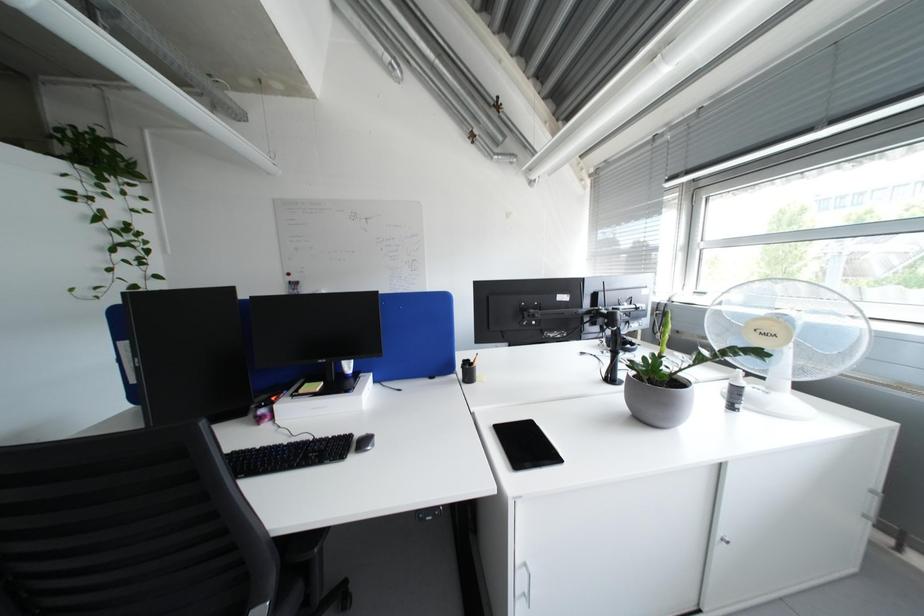
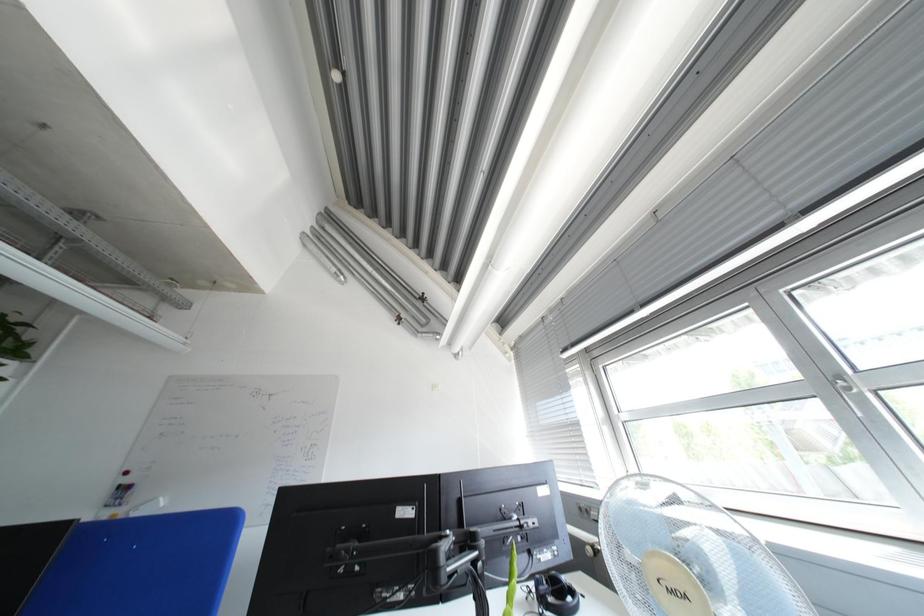
Question: How did the camera likely rotate?

Choices:
 (A) Left
 (B) Right
 (C) Up
 (D) Down

Answer: (C)